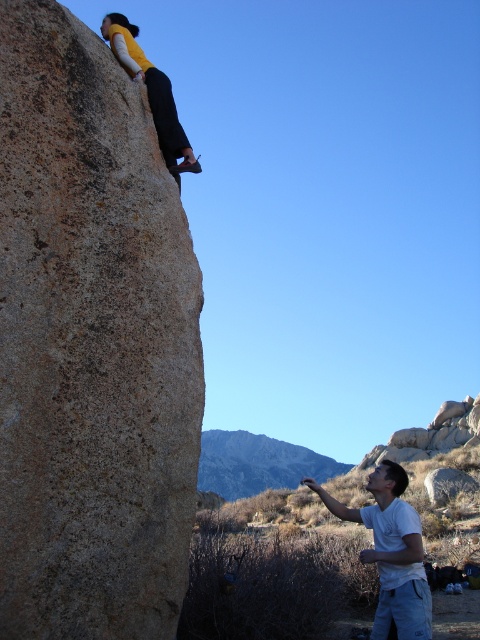
Question: Is rough textured rock at upper left bigger than smooth gray rock at lower right?

Choices:
 (A) no
 (B) yes

Answer: (A)

Question: Estimate the real-world distances between objects in this image. Which object is closer to the matte yellow shirt at upper center?

Choices:
 (A) smooth gray rock at lower right
 (B) white cotton shirt at lower right
 (C) rough textured rock at upper left

Answer: (C)

Question: Which of these objects is positioned farthest from the white cotton shirt at lower right?

Choices:
 (A) smooth gray rock at lower right
 (B) rough textured rock at upper left
 (C) matte yellow shirt at upper center

Answer: (A)

Question: Which object appears farthest from the camera in this image?

Choices:
 (A) smooth gray rock at lower right
 (B) white cotton shirt at lower right
 (C) rough textured rock at upper left
 (D) matte yellow shirt at upper center

Answer: (A)

Question: Does rough textured rock at upper left appear on the right side of smooth gray rock at lower right?

Choices:
 (A) yes
 (B) no

Answer: (B)

Question: Can you confirm if rough textured rock at upper left is thinner than matte yellow shirt at upper center?

Choices:
 (A) no
 (B) yes

Answer: (B)